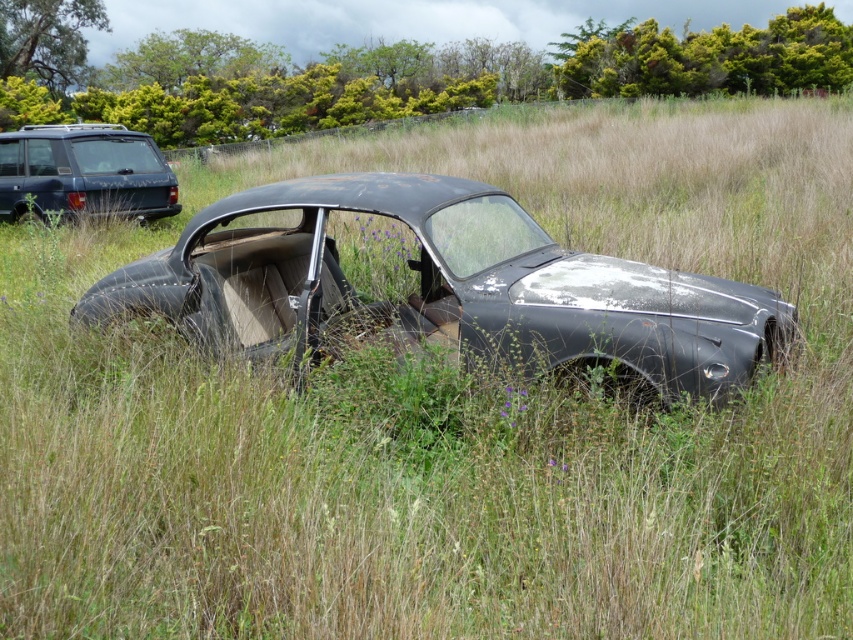
Question: Is the position of rusty metallic car at center less distant than that of matte black suv at upper left?

Choices:
 (A) yes
 (B) no

Answer: (A)

Question: Can you confirm if rusty metallic car at center is wider than matte black suv at upper left?

Choices:
 (A) no
 (B) yes

Answer: (B)

Question: Is rusty metallic car at center smaller than matte black suv at upper left?

Choices:
 (A) no
 (B) yes

Answer: (A)